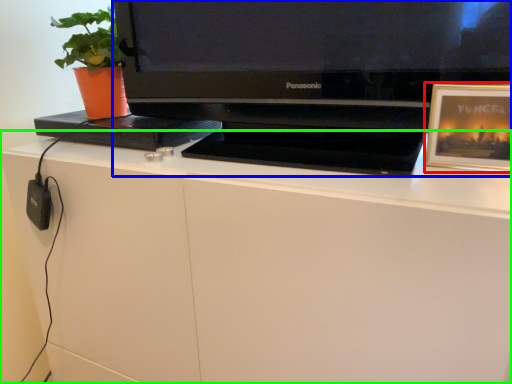
Question: Considering the real-world distances, which object is closest to picture frame (highlighted by a red box)? television (highlighted by a blue box) or desk (highlighted by a green box).

Choices:
 (A) television
 (B) desk

Answer: (A)